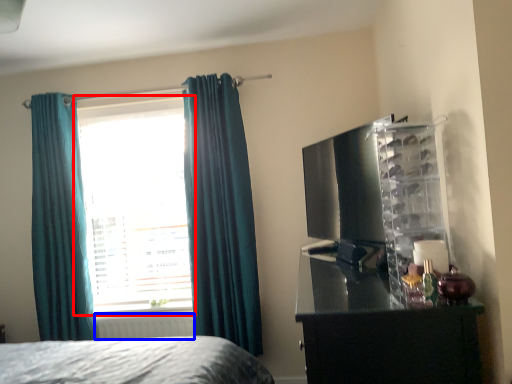
Question: Which point is closer to the camera, window (highlighted by a red box) or radiator (highlighted by a blue box)?

Choices:
 (A) window
 (B) radiator

Answer: (B)